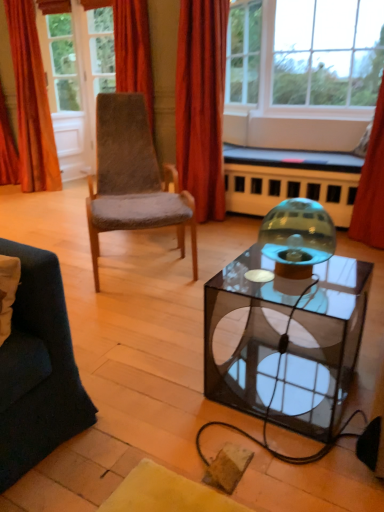
Question: Can transparent glass table at center be found inside transparent glass window at upper center, the 2th window viewed from the left?

Choices:
 (A) yes
 (B) no

Answer: (B)

Question: Is transparent glass window at upper center, which is the first window from right to left, positioned with its back to transparent glass table at center?

Choices:
 (A) no
 (B) yes

Answer: (A)

Question: From a real-world perspective, is transparent glass window at upper center, which is the first window from right to left, positioned under transparent glass table at center based on gravity?

Choices:
 (A) no
 (B) yes

Answer: (A)

Question: Considering the relative positions of transparent glass window at upper center, the 2th window viewed from the left, and transparent glass table at center in the image provided, is transparent glass window at upper center, the 2th window viewed from the left, to the right of transparent glass table at center from the viewer's perspective?

Choices:
 (A) no
 (B) yes

Answer: (B)

Question: Are transparent glass window at upper center, which is the first window from right to left, and transparent glass table at center located far from each other?

Choices:
 (A) no
 (B) yes

Answer: (B)

Question: Is transparent glass window at upper center, the 2th window viewed from the left, bigger than transparent glass table at center?

Choices:
 (A) no
 (B) yes

Answer: (B)

Question: Does orange velvet curtain at upper left, which is the 3th curtain in right-to-left order, have a smaller size compared to red velvet curtain at center, acting as the 1th curtain starting from the right?

Choices:
 (A) yes
 (B) no

Answer: (A)

Question: Is orange velvet curtain at upper left, which is the 3th curtain in right-to-left order, not close to red velvet curtain at center, positioned as the 3th curtain in left-to-right order?

Choices:
 (A) no
 (B) yes

Answer: (B)

Question: From a real-world perspective, does orange velvet curtain at upper left, the 1th curtain in the left-to-right sequence, stand above red velvet curtain at center, acting as the 1th curtain starting from the right?

Choices:
 (A) yes
 (B) no

Answer: (A)

Question: Does orange velvet curtain at upper left, which is the 3th curtain in right-to-left order, touch red velvet curtain at center, acting as the 1th curtain starting from the right?

Choices:
 (A) yes
 (B) no

Answer: (B)

Question: Is red velvet curtain at center, acting as the 1th curtain starting from the right, inside orange velvet curtain at upper left, the 1th curtain in the left-to-right sequence?

Choices:
 (A) no
 (B) yes

Answer: (A)

Question: Considering the relative sizes of orange velvet curtain at upper left, the 1th curtain in the left-to-right sequence, and red velvet curtain at center, positioned as the 3th curtain in left-to-right order, in the image provided, is orange velvet curtain at upper left, the 1th curtain in the left-to-right sequence, thinner than red velvet curtain at center, positioned as the 3th curtain in left-to-right order,?

Choices:
 (A) yes
 (B) no

Answer: (A)

Question: From the image's perspective, is transparent glass door at upper left located beneath clear glass window at upper center, which is the first window in left-to-right order?

Choices:
 (A) yes
 (B) no

Answer: (B)